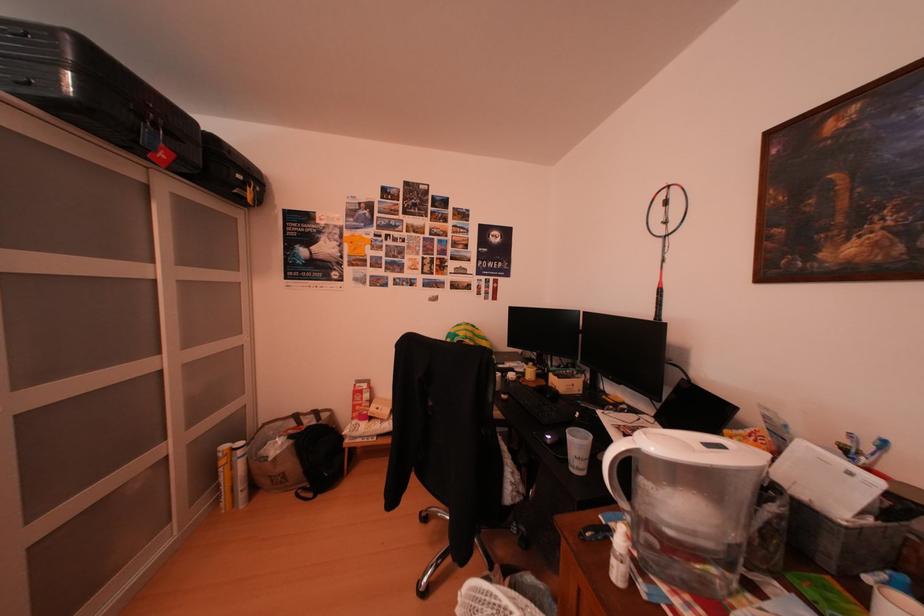
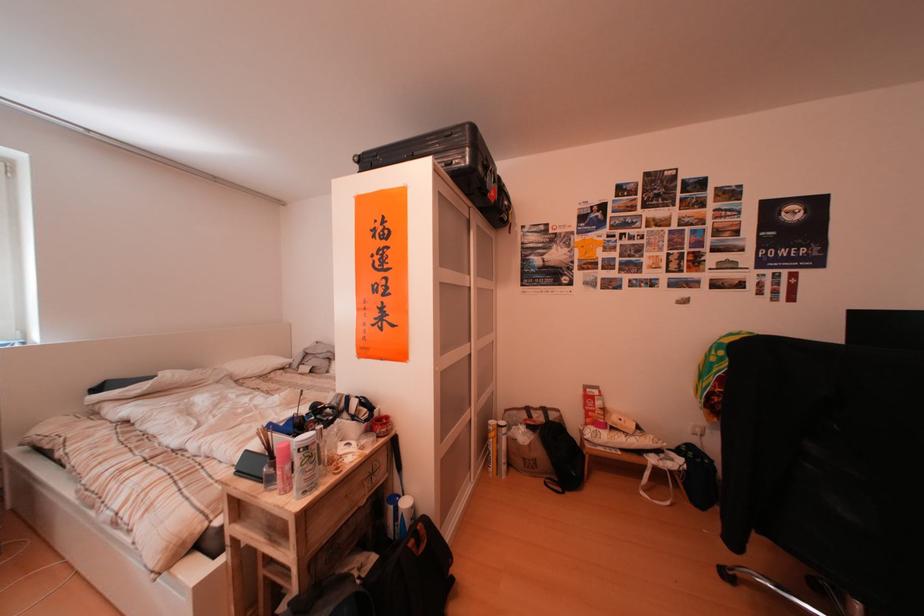
The point at (236, 467) is marked in the first image. Where is the corresponding point in the second image?

(505, 440)